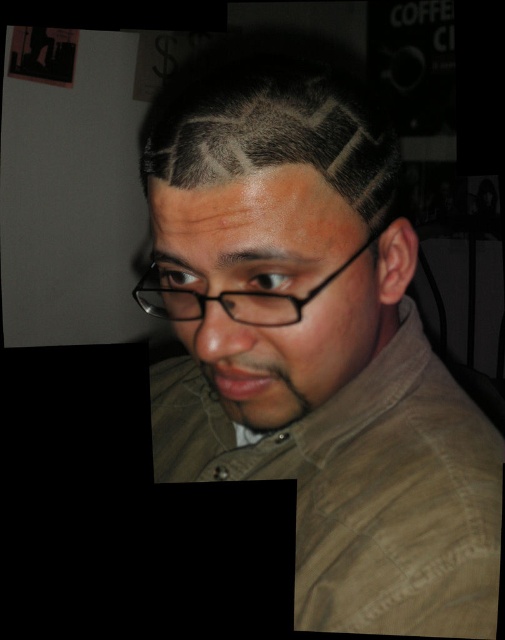
Question: Which object appears farthest from the camera in this image?

Choices:
 (A) dark brown hair at center
 (B) dark gray hair at center

Answer: (A)

Question: Does dark brown hair at center have a lesser width compared to dark gray hair at center?

Choices:
 (A) no
 (B) yes

Answer: (A)

Question: Which object is positioned farthest from the dark gray hair at center?

Choices:
 (A) dark brown hair at center
 (B) black plastic glasses at center

Answer: (B)

Question: Does dark brown hair at center have a larger size compared to black plastic glasses at center?

Choices:
 (A) yes
 (B) no

Answer: (A)

Question: Estimate the real-world distances between objects in this image. Which object is closer to the black plastic glasses at center?

Choices:
 (A) dark brown hair at center
 (B) dark gray hair at center

Answer: (A)

Question: Does dark brown hair at center appear over black plastic glasses at center?

Choices:
 (A) yes
 (B) no

Answer: (A)